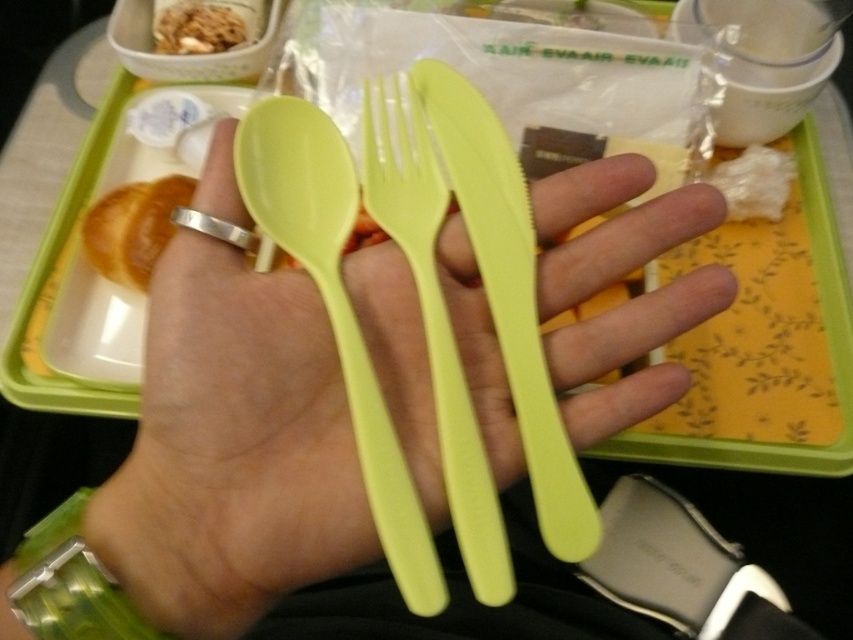
You are a flight attendant checking the meal tray. You see the lime green plastic utensils at center and the brown crumbly at upper left. Which item is closer to you?

The lime green plastic utensils at center are closer to you because they are in front of the brown crumbly at upper left.

You are a flight attendant on an airplane. You need to place a new tray of food for a passenger. The tray already has a lime green plastic spoon at center and a brown crumbly at upper left. The distance between them is 14.53 inches. If the new food item must be placed exactly halfway between them, where should you put it?

The new food item should be placed exactly halfway between the lime green plastic spoon at center and the brown crumbly at upper left, which would be at 7.265 inches from each object.